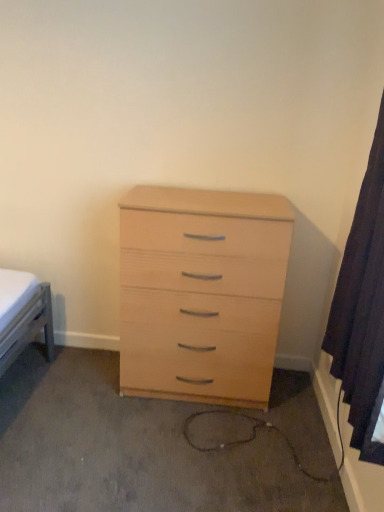
This screenshot has width=384, height=512. What are the coordinates of `dark fabric curtain at right` in the screenshot? It's located at (362, 306).

What do you see at coordinates (362, 306) in the screenshot? This screenshot has width=384, height=512. I see `dark fabric curtain at right` at bounding box center [362, 306].

Identify the location of light wood chest of drawers at center. This screenshot has height=512, width=384. (201, 292).

Describe the element at coordinates (201, 292) in the screenshot. I see `light wood chest of drawers at center` at that location.

Identify the location of dark fabric curtain at right. The width and height of the screenshot is (384, 512). (362, 306).

Which object is positioned more to the right, light wood chest of drawers at center or dark fabric curtain at right?

dark fabric curtain at right is more to the right.

Which object is closer to the camera taking this photo, light wood chest of drawers at center or dark fabric curtain at right?

dark fabric curtain at right is closer to the camera.

Is point (141, 304) more distant than point (367, 452)?

Yes, point (141, 304) is farther from viewer.

From the image's perspective, which is below, light wood chest of drawers at center or dark fabric curtain at right?

light wood chest of drawers at center.

From a real-world perspective, does light wood chest of drawers at center sit lower than dark fabric curtain at right?

Yes.

Is light wood chest of drawers at center wider or thinner than dark fabric curtain at right?

In the image, light wood chest of drawers at center appears to be wider than dark fabric curtain at right.

Which of these two, light wood chest of drawers at center or dark fabric curtain at right, stands shorter?

With less height is light wood chest of drawers at center.

Is light wood chest of drawers at center bigger or smaller than dark fabric curtain at right?

In the image, light wood chest of drawers at center appears to be larger than dark fabric curtain at right.

Is light wood chest of drawers at center outside of dark fabric curtain at right?

Absolutely, light wood chest of drawers at center is external to dark fabric curtain at right.

Does light wood chest of drawers at center touch dark fabric curtain at right?

light wood chest of drawers at center and dark fabric curtain at right are not in contact.

Is dark fabric curtain at right at the back of light wood chest of drawers at center?

That's not correct — light wood chest of drawers at center is not looking away from dark fabric curtain at right.

At what (x,y) coordinates should I click in order to perform the action: click on curtain in front of the light wood chest of drawers at center. Please return your answer as a coordinate pair (x, y). The image size is (384, 512). Looking at the image, I should click on (362, 306).

Considering the relative positions of dark fabric curtain at right and light wood chest of drawers at center in the image provided, is dark fabric curtain at right to the left of light wood chest of drawers at center from the viewer's perspective?

No, dark fabric curtain at right is not to the left of light wood chest of drawers at center.

Looking at this image, is the depth of dark fabric curtain at right less than that of light wood chest of drawers at center?

Yes, dark fabric curtain at right is closer to the camera.

Between point (364, 289) and point (183, 388), which one is positioned behind?

The point (183, 388) is more distant.

From the image's perspective, which is above, dark fabric curtain at right or light wood chest of drawers at center?

dark fabric curtain at right.

From a real-world perspective, is dark fabric curtain at right physically below light wood chest of drawers at center?

Actually, dark fabric curtain at right is physically above light wood chest of drawers at center in the real world.

Between dark fabric curtain at right and light wood chest of drawers at center, which one has larger width?

light wood chest of drawers at center is wider.

Can you confirm if dark fabric curtain at right is shorter than light wood chest of drawers at center?

Incorrect, the height of dark fabric curtain at right does not fall short of that of light wood chest of drawers at center.

Between dark fabric curtain at right and light wood chest of drawers at center, which one has larger size?

Bigger between the two is light wood chest of drawers at center.

Is light wood chest of drawers at center a part of dark fabric curtain at right?

That's incorrect, light wood chest of drawers at center is not inside dark fabric curtain at right.

Is there a large distance between dark fabric curtain at right and light wood chest of drawers at center?

No, dark fabric curtain at right is in close proximity to light wood chest of drawers at center.

Based on the photo, is dark fabric curtain at right positioned with its back to light wood chest of drawers at center?

No, dark fabric curtain at right is not facing away from light wood chest of drawers at center.

This screenshot has width=384, height=512. In order to click on curtain in front of the light wood chest of drawers at center in this screenshot , I will do `click(362, 306)`.

The height and width of the screenshot is (512, 384). What are the coordinates of `chest of drawers on the left of dark fabric curtain at right` in the screenshot? It's located at (201, 292).

Identify the location of chest of drawers below the dark fabric curtain at right (from the image's perspective). This screenshot has height=512, width=384. (201, 292).